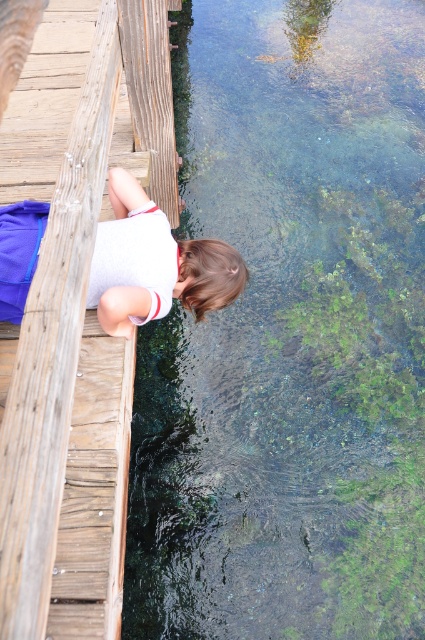
Question: Does clear water at lower left have a greater width compared to wooden dock at left?

Choices:
 (A) yes
 (B) no

Answer: (A)

Question: Which object is positioned closest to the wooden dock at left?

Choices:
 (A) clear water at lower left
 (B) white matte shirt at upper left

Answer: (B)

Question: Does wooden dock at left lie in front of white matte shirt at upper left?

Choices:
 (A) no
 (B) yes

Answer: (B)

Question: Which point appears closest to the camera in this image?

Choices:
 (A) (163, 264)
 (B) (374, 266)

Answer: (A)

Question: Which point appears closest to the camera in this image?

Choices:
 (A) (226, 259)
 (B) (254, 634)

Answer: (B)

Question: Does clear water at lower left appear on the left side of white matte shirt at upper left?

Choices:
 (A) no
 (B) yes

Answer: (A)